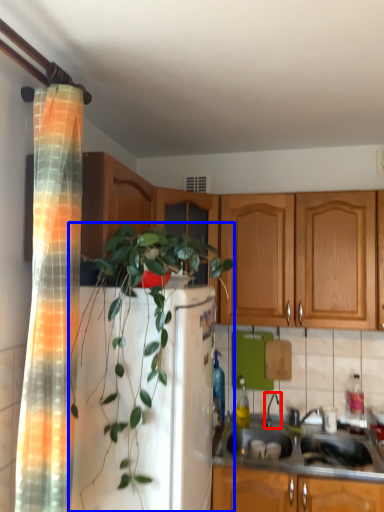
Question: Which object appears farthest to the camera in this image, faucet (highlighted by a red box) or houseplant (highlighted by a blue box)?

Choices:
 (A) faucet
 (B) houseplant

Answer: (A)